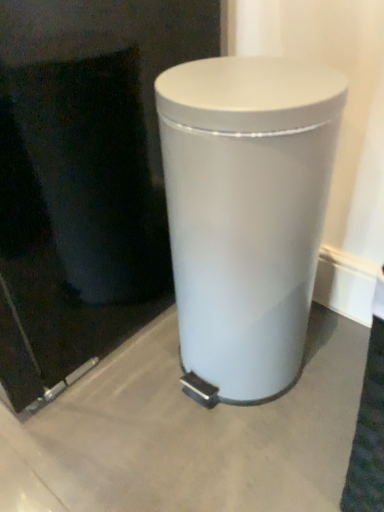
Question: Should I look upward or downward to see white matte waste container at center?

Choices:
 (A) down
 (B) up

Answer: (B)